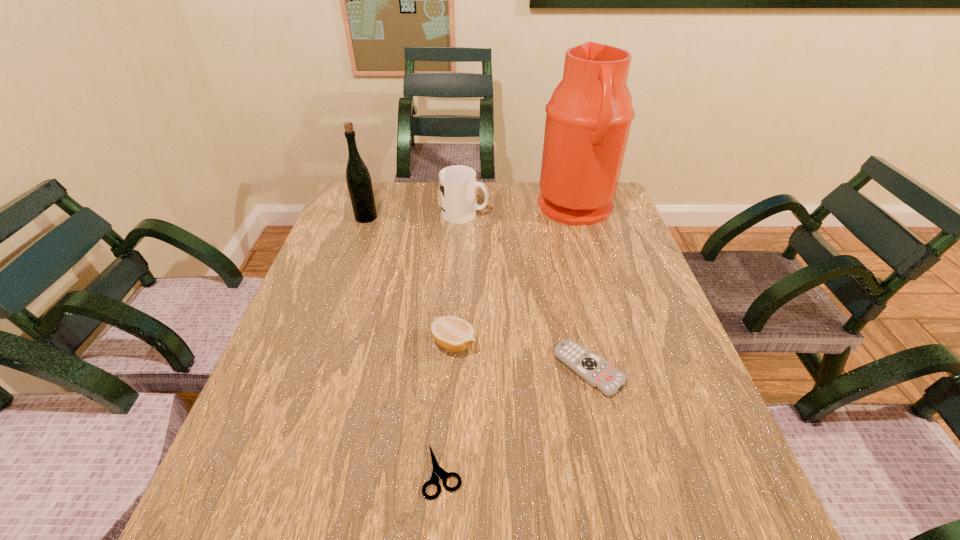
You are a GUI agent. You are given a task and a screenshot of the screen. Output one action in this format:
    pyautogui.click(x=<x>, y=<y>)
    Task: Click on the tallest object
    The width and height of the screenshot is (960, 540).
    Given the screenshot: What is the action you would take?
    pyautogui.click(x=588, y=118)

Locate an element on the screen. Image resolution: width=960 pixels, height=540 pixels. beer bottle is located at coordinates tap(359, 183).

The image size is (960, 540). Find the location of `the fifth shortest object`. the fifth shortest object is located at coordinates (359, 183).

Find the location of a particular element. This screenshot has height=540, width=960. mug is located at coordinates (458, 184).

Image resolution: width=960 pixels, height=540 pixels. I want to click on the third shortest object, so coord(454,334).

Where is `remote control`? remote control is located at coordinates (597, 372).

You are a GUI agent. You are given a task and a screenshot of the screen. Output one action in this format:
    pyautogui.click(x=<x>, y=<y>)
    Task: Click on the shears
    Image resolution: width=960 pixels, height=540 pixels.
    Given the screenshot: What is the action you would take?
    pyautogui.click(x=438, y=472)

At what (x,y) coordinates should I click in order to perform the action: click on the shortest object. Please return your answer as a coordinate pair (x, y). Looking at the image, I should click on (438, 472).

The width and height of the screenshot is (960, 540). I want to click on free point located 0.050m from the spout of the tallest object, so click(521, 209).

Locate an element on the screen. The height and width of the screenshot is (540, 960). free spot located from the spout of the tallest object is located at coordinates (499, 209).